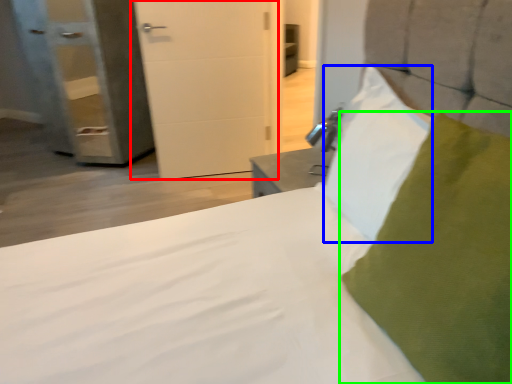
Question: Which is farther away from door (highlighted by a red box)? pillow (highlighted by a blue box) or pillow (highlighted by a green box)?

Choices:
 (A) pillow
 (B) pillow

Answer: (B)